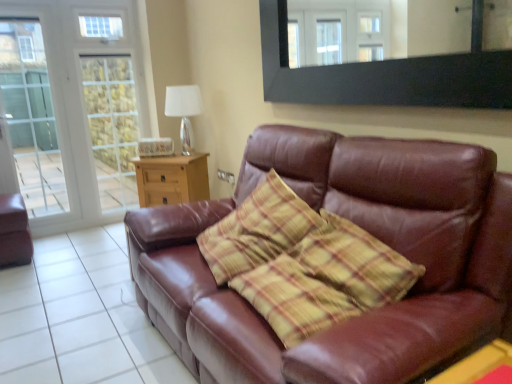
Question: Does matte brown leather armchair at left have a greater width compared to brown leather couch at lower right?

Choices:
 (A) yes
 (B) no

Answer: (B)

Question: Can brown leather couch at lower right be found inside matte brown leather armchair at left?

Choices:
 (A) no
 (B) yes

Answer: (A)

Question: Considering the relative sizes of matte brown leather armchair at left and brown leather couch at lower right in the image provided, is matte brown leather armchair at left smaller than brown leather couch at lower right?

Choices:
 (A) no
 (B) yes

Answer: (B)

Question: From a real-world perspective, is matte brown leather armchair at left located beneath brown leather couch at lower right?

Choices:
 (A) yes
 (B) no

Answer: (B)

Question: Considering the relative sizes of matte brown leather armchair at left and brown leather couch at lower right in the image provided, is matte brown leather armchair at left bigger than brown leather couch at lower right?

Choices:
 (A) yes
 (B) no

Answer: (B)

Question: Is matte brown leather armchair at left to the left of brown leather couch at lower right from the viewer's perspective?

Choices:
 (A) yes
 (B) no

Answer: (A)

Question: Is black matte mirror at upper center oriented away from clear glass screen door at left?

Choices:
 (A) no
 (B) yes

Answer: (A)

Question: Considering the relative sizes of black matte mirror at upper center and clear glass screen door at left in the image provided, is black matte mirror at upper center smaller than clear glass screen door at left?

Choices:
 (A) yes
 (B) no

Answer: (A)

Question: Is black matte mirror at upper center taller than clear glass screen door at left?

Choices:
 (A) yes
 (B) no

Answer: (B)

Question: Is the position of black matte mirror at upper center more distant than that of clear glass screen door at left?

Choices:
 (A) no
 (B) yes

Answer: (A)

Question: Is black matte mirror at upper center not near clear glass screen door at left?

Choices:
 (A) yes
 (B) no

Answer: (A)

Question: Is black matte mirror at upper center positioned before clear glass screen door at left?

Choices:
 (A) no
 (B) yes

Answer: (B)

Question: Is the depth of matte brown leather armchair at left less than that of wooden side table at center, positioned as the second table in right-to-left order?

Choices:
 (A) yes
 (B) no

Answer: (A)